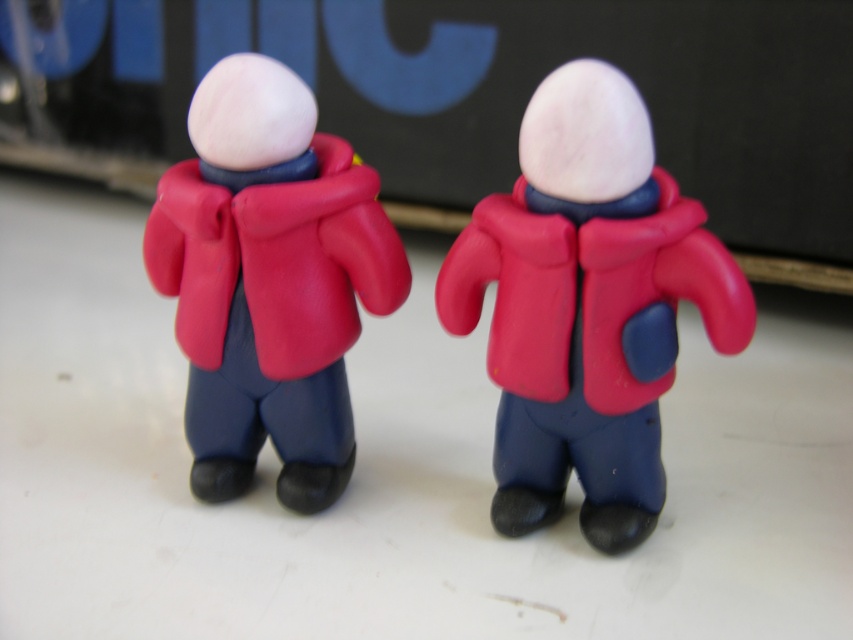
You are an art student who needs to choose between the two items for a project that requires a larger piece. Which one between the rubberized matte red jacket at center and the rubberized matte red coat at center should you select?

The rubberized matte red jacket at center is bigger than the rubberized matte red coat at center, so you should select the rubberized matte red jacket at center for your project.

From the picture: You are holding a camera and want to take a photo of the rubberized matte red jacket at center. The camera requires a minimum distance of 40 inches to focus properly. Based on the information provided, will the camera be able to focus on the jacket?

The rubberized matte red jacket at center and camera are 37.28 inches apart. Since the required minimum distance is 40 inches, the camera will not be able to focus on the jacket as it is too close.